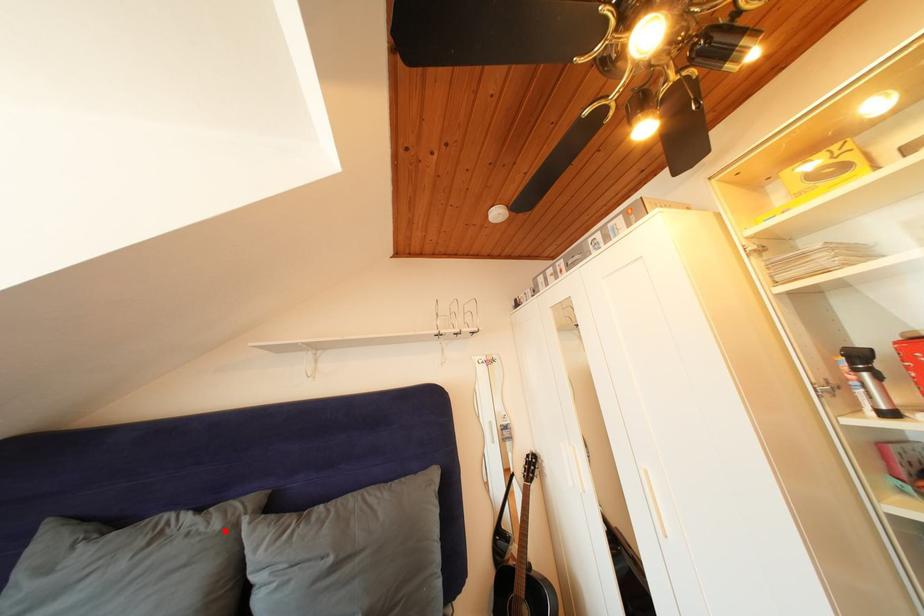
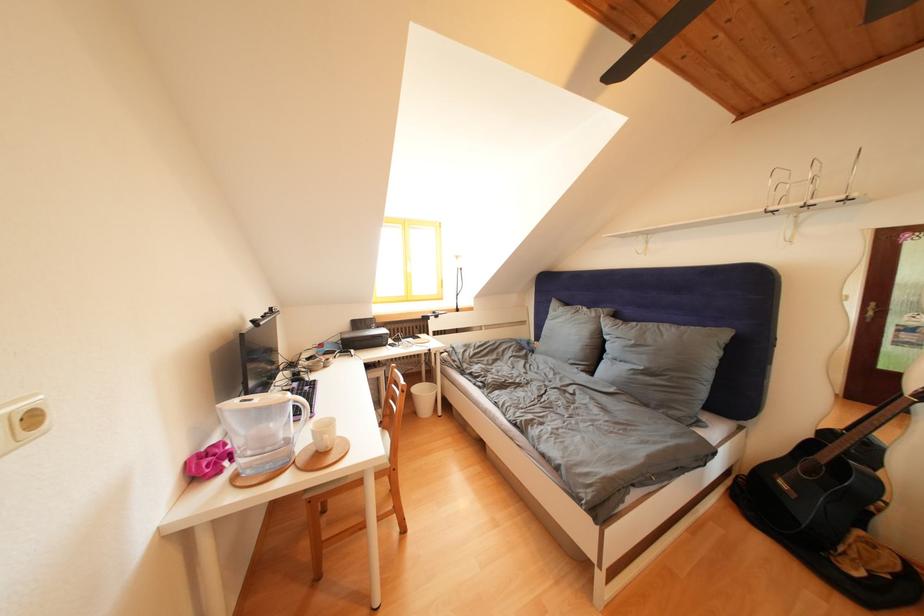
In the second image, find the point that corresponds to the highlighted location in the first image.

(602, 320)